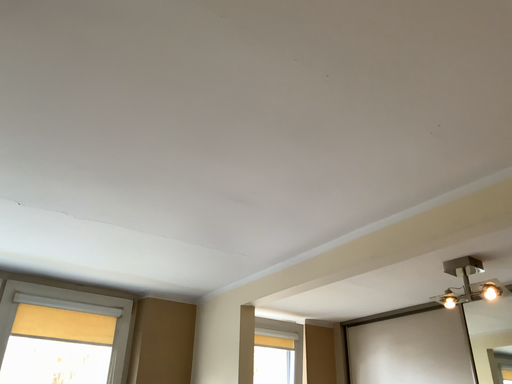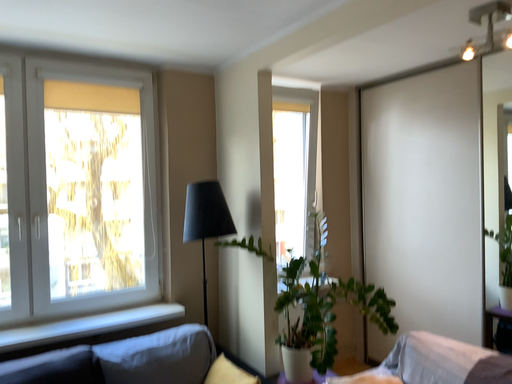
Question: How did the camera likely rotate when shooting the video?

Choices:
 (A) rotated downward
 (B) rotated upward

Answer: (A)